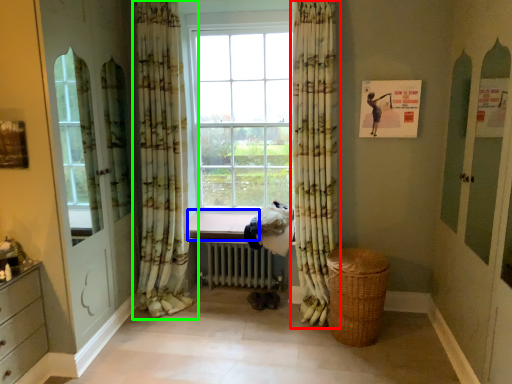
Question: Estimate the real-world distances between objects in this image. Which object is farther from curtain (highlighted by a red box), window sill (highlighted by a blue box) or curtain (highlighted by a green box)?

Choices:
 (A) window sill
 (B) curtain

Answer: (B)